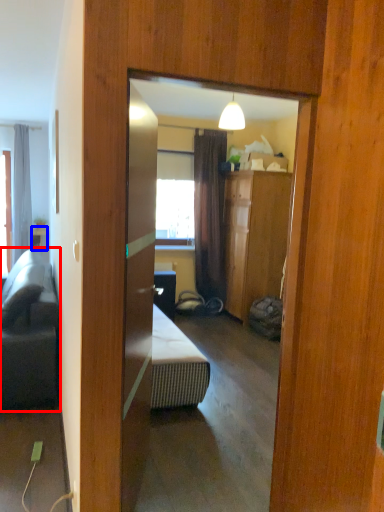
Question: Which of the following is the farthest to the observer, studio couch (highlighted by a red box) or table (highlighted by a blue box)?

Choices:
 (A) studio couch
 (B) table

Answer: (B)